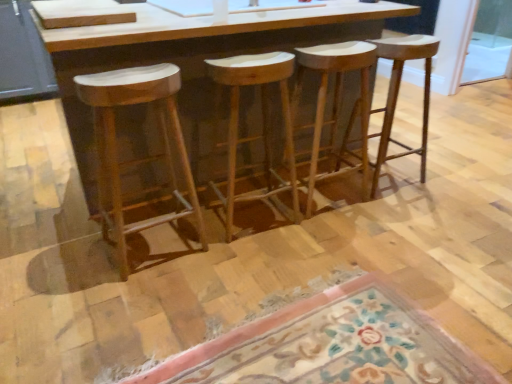
This screenshot has height=384, width=512. I want to click on vacant area situated below natural wood stool at center, which appears as the second stool when viewed from the left (from a real-world perspective), so click(x=253, y=217).